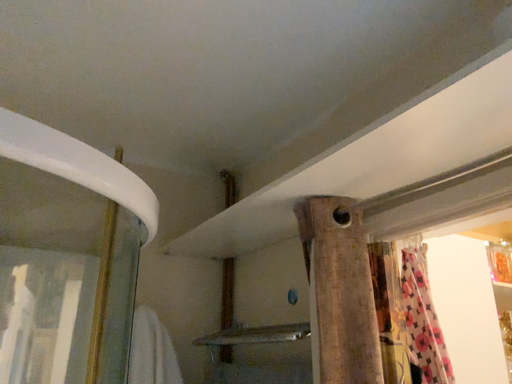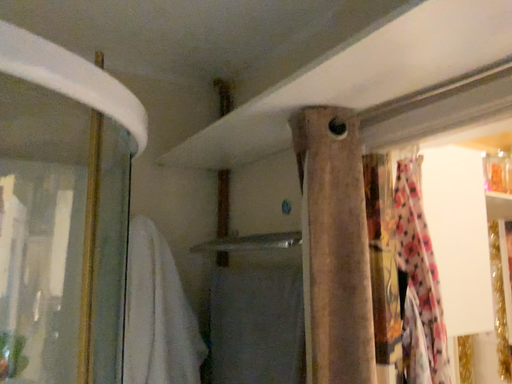
Question: How did the camera likely rotate when shooting the video?

Choices:
 (A) rotated downward
 (B) rotated upward

Answer: (A)